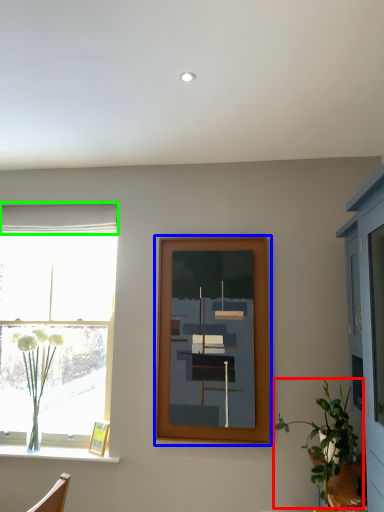
Question: Estimate the real-world distances between objects in this image. Which object is closer to houseplant (highlighted by a red box), picture frame (highlighted by a blue box) or curtain (highlighted by a green box)?

Choices:
 (A) picture frame
 (B) curtain

Answer: (A)